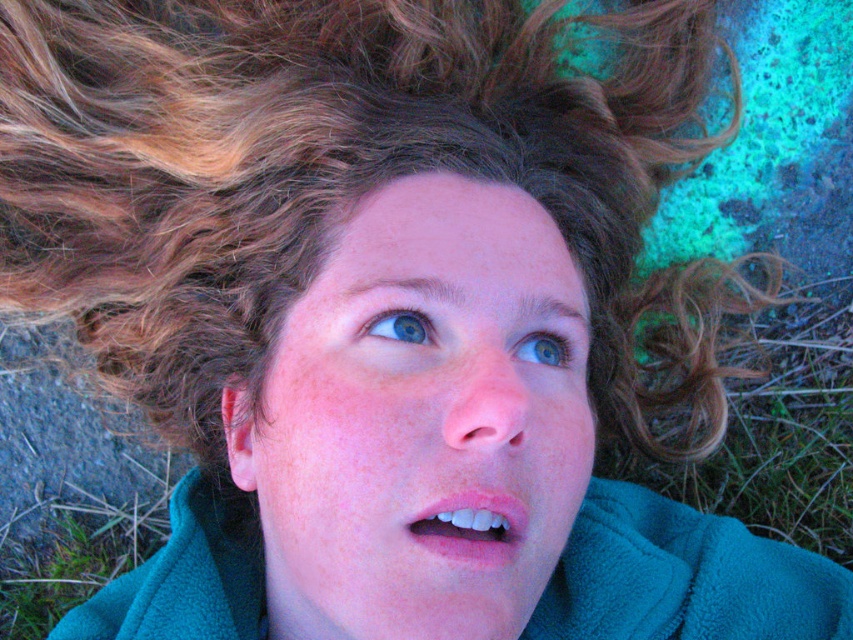
From the picture: Who is more forward, (538,541) or (422,324)?

Point (538,541)

Describe the element at coordinates (421, 420) in the screenshot. Image resolution: width=853 pixels, height=640 pixels. I see `smooth skin face at center` at that location.

This screenshot has width=853, height=640. What do you see at coordinates (421, 420) in the screenshot? I see `smooth skin face at center` at bounding box center [421, 420].

Image resolution: width=853 pixels, height=640 pixels. Identify the location of smooth skin face at center. (421, 420).

Who is higher up, smooth skin face at center or teal fleece robe at center?

smooth skin face at center is above.

Between point (373, 397) and point (189, 472), which one is positioned behind?

Point (189, 472)

I want to click on smooth skin face at center, so click(x=421, y=420).

How distant is blue matte eye at upper center from blue glossy eye at upper center?

blue matte eye at upper center is 2.36 inches from blue glossy eye at upper center.

Between point (430, 344) and point (560, 360), which one is positioned in front?

Point (430, 344)

In order to click on blue matte eye at upper center in this screenshot , I will do `click(402, 326)`.